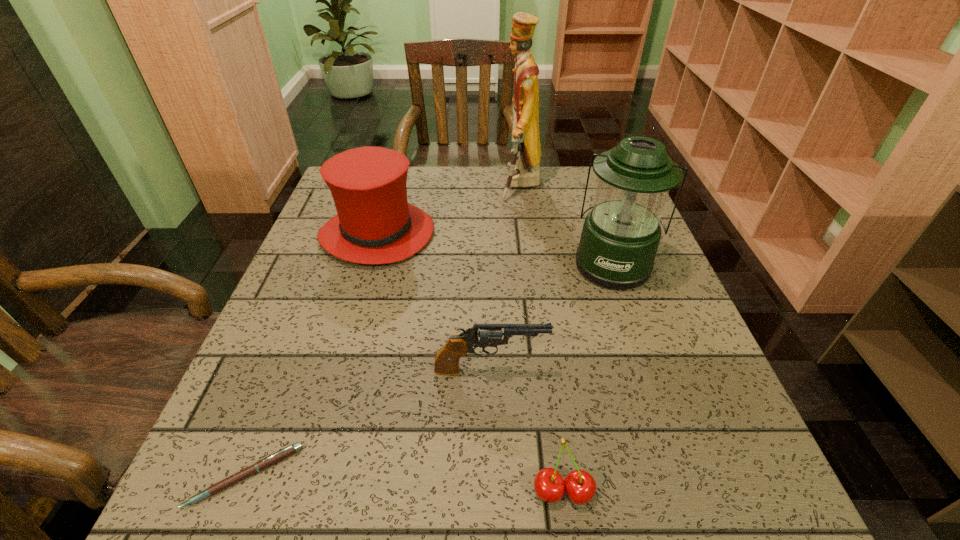
Image resolution: width=960 pixels, height=540 pixels. I want to click on nutcracker, so click(x=524, y=166).

Identify the location of the rightmost object. Image resolution: width=960 pixels, height=540 pixels. (620, 237).

Find the location of a particular element. This screenshot has height=540, width=960. lantern is located at coordinates (620, 237).

Image resolution: width=960 pixels, height=540 pixels. Identify the location of the third tallest object. (375, 224).

Locate an element on the screen. The image size is (960, 540). gun is located at coordinates (447, 359).

Identify the location of cherry. Image resolution: width=960 pixels, height=540 pixels. (580, 486).

The image size is (960, 540). I want to click on pen, so click(x=268, y=461).

Image resolution: width=960 pixels, height=540 pixels. In order to click on vacant space positioned 0.110m on the front-facing side of the nutcracker in this screenshot , I will do click(x=462, y=186).

Where is `vacant region located 0.060m on the front-facing side of the nutcracker`? The height and width of the screenshot is (540, 960). vacant region located 0.060m on the front-facing side of the nutcracker is located at coordinates pos(479,186).

Where is `free space located on the front-facing side of the nutcracker`? This screenshot has width=960, height=540. free space located on the front-facing side of the nutcracker is located at coordinates (462, 186).